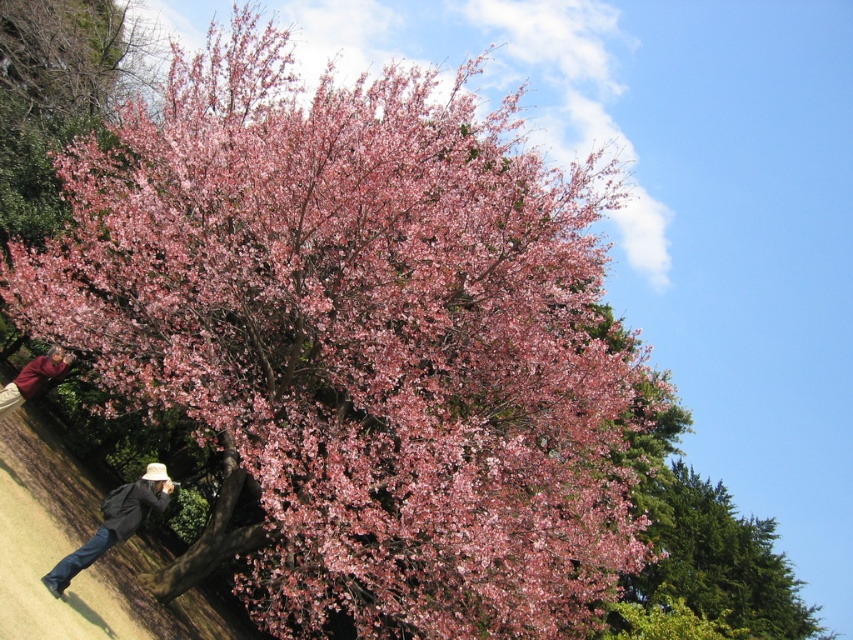
Question: Which of the following is the closest to the observer?

Choices:
 (A) denim jacket at lower left
 (B) matte brown jacket at lower left

Answer: (A)

Question: Can you confirm if denim jacket at lower left is positioned below matte brown jacket at lower left?

Choices:
 (A) no
 (B) yes

Answer: (B)

Question: From the image, what is the correct spatial relationship of denim jacket at lower left in relation to matte brown jacket at lower left?

Choices:
 (A) right
 (B) left

Answer: (A)

Question: Does denim jacket at lower left come in front of matte brown jacket at lower left?

Choices:
 (A) no
 (B) yes

Answer: (B)